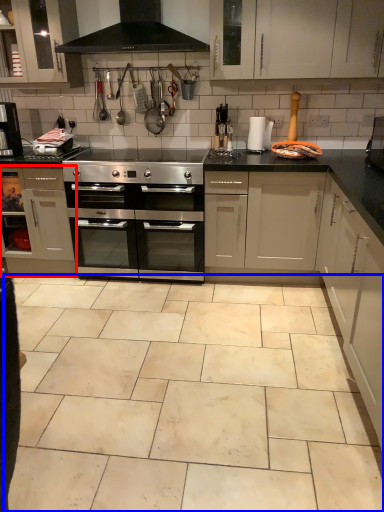
Question: Which object is further to the camera taking this photo, cabinetry (highlighted by a red box) or ceramic tile (highlighted by a blue box)?

Choices:
 (A) cabinetry
 (B) ceramic tile

Answer: (A)